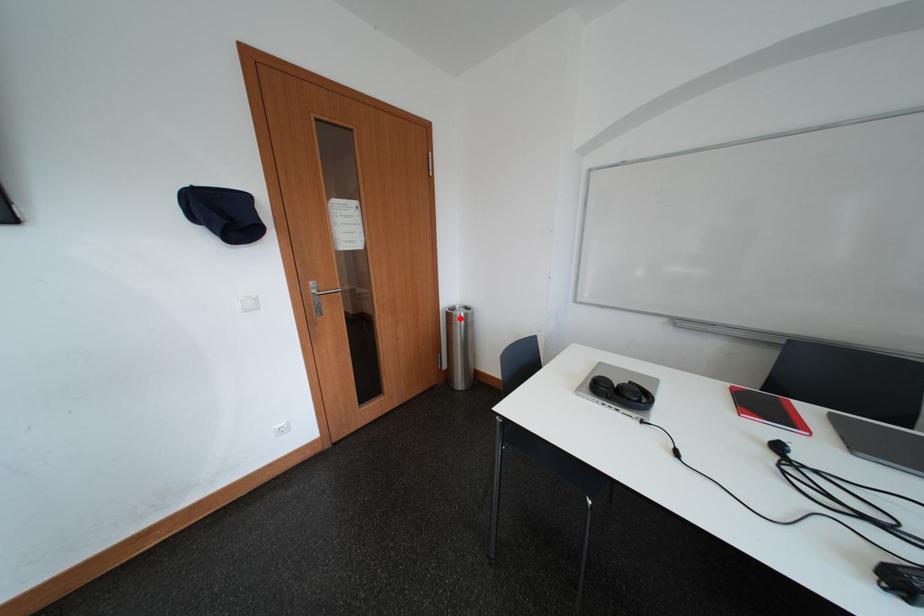
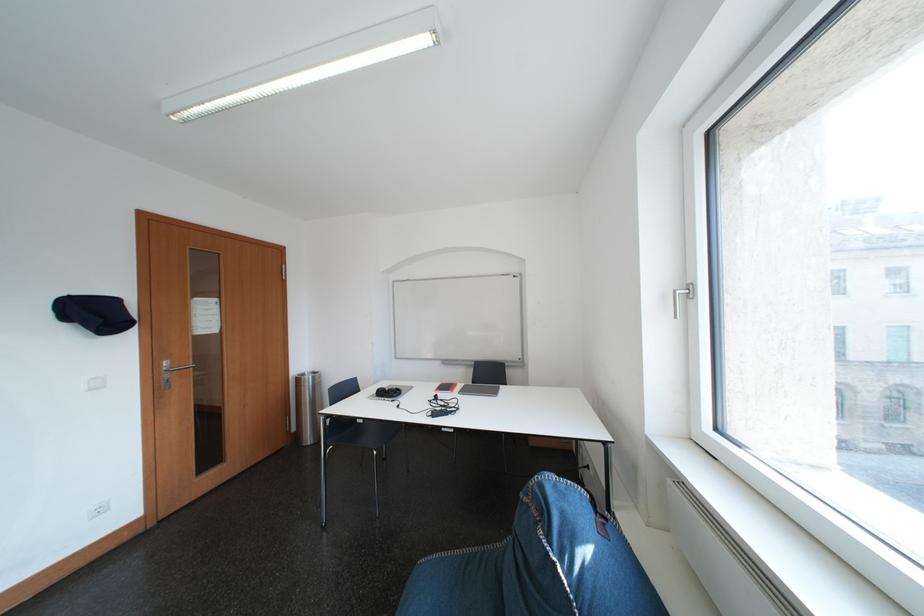
In the second image, find the point that corresponds to the highlighted location in the first image.

(310, 383)